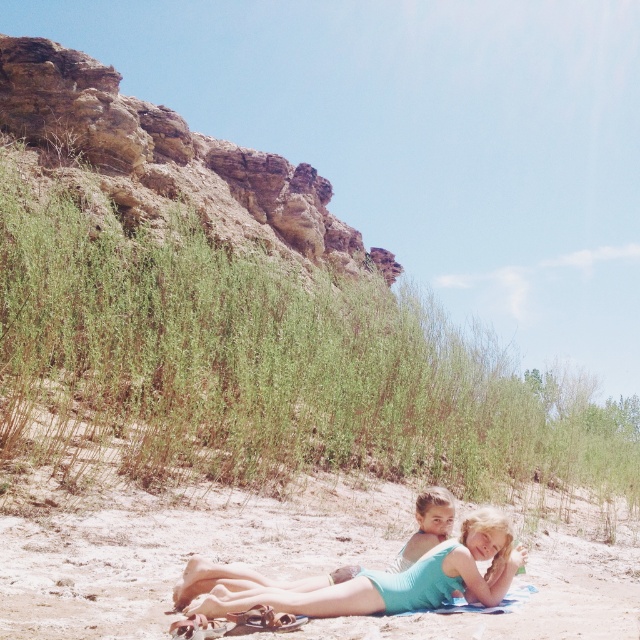
Between light blue swimsuit at center and teal fabric swimsuit at lower center, which one is positioned higher?

Positioned higher is teal fabric swimsuit at lower center.

Can you confirm if light blue swimsuit at center is positioned above teal fabric swimsuit at lower center?

No.

Who is more forward, (141, 620) or (488, 532)?

Point (141, 620) is more forward.

I want to click on light blue swimsuit at center, so click(x=164, y=534).

Who is more distant from viewer, (241, 493) or (74, 77)?

Point (74, 77)

Between light blue swimsuit at center and rustic stone cliff at upper left, which one is positioned lower?

light blue swimsuit at center

Is point (109, 545) closer to camera compared to point (124, 209)?

Yes, it is.

Locate an element on the screen. light blue swimsuit at center is located at coordinates (164, 534).

Which of these two, rustic stone cliff at upper left or teal fabric swimsuit at lower center, stands taller?

With more height is rustic stone cliff at upper left.

Can you confirm if rustic stone cliff at upper left is thinner than teal fabric swimsuit at lower center?

Incorrect, rustic stone cliff at upper left's width is not less than teal fabric swimsuit at lower center's.

This screenshot has width=640, height=640. In order to click on rustic stone cliff at upper left in this screenshot , I will do `click(168, 161)`.

Where is `rustic stone cliff at upper left`? rustic stone cliff at upper left is located at coordinates (168, 161).